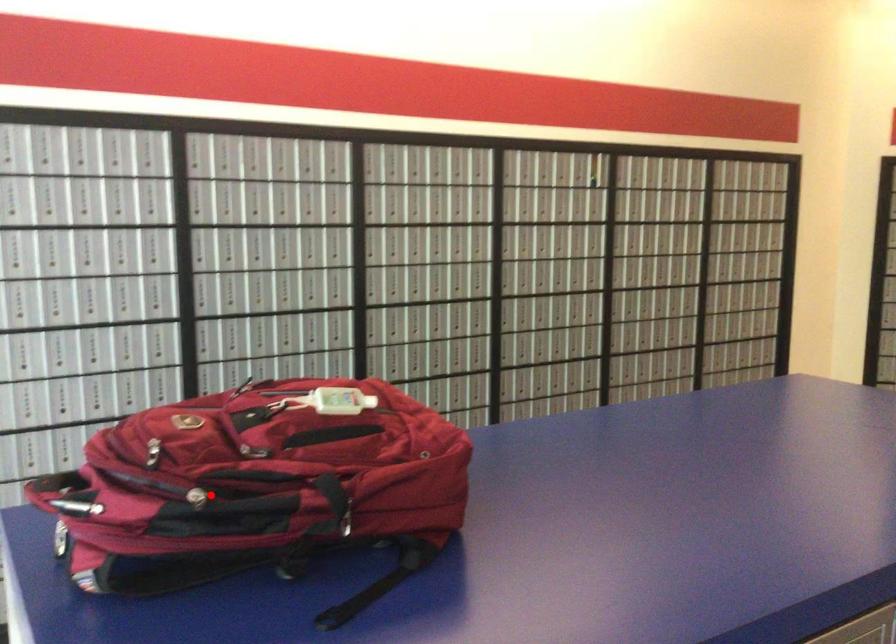
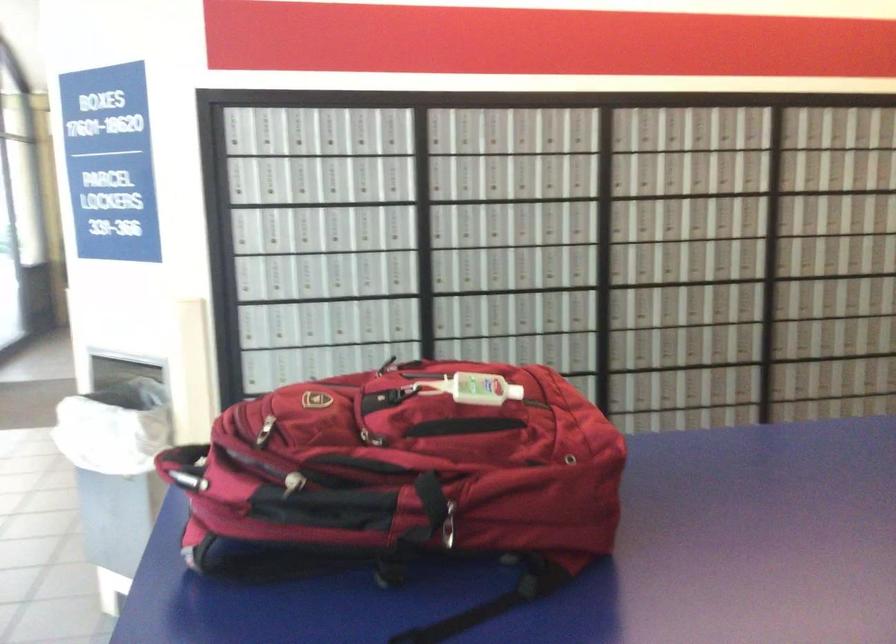
In the second image, find the point that corresponds to the highlighted location in the first image.

(293, 483)